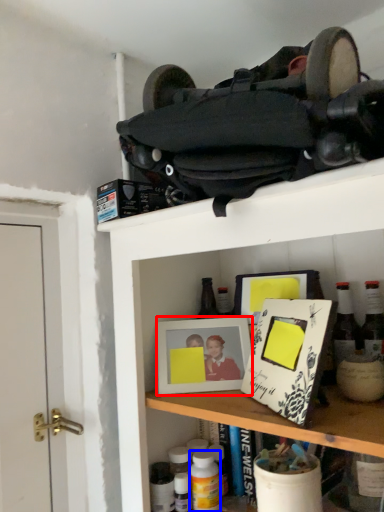
Question: Which of the following is the closest to the observer, picture frame (highlighted by a red box) or bottle (highlighted by a blue box)?

Choices:
 (A) picture frame
 (B) bottle

Answer: (B)